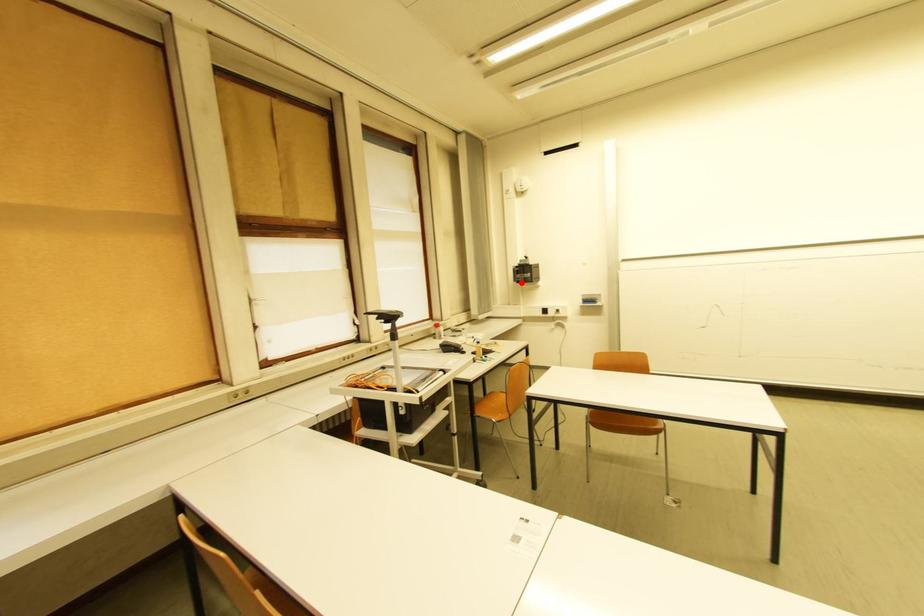
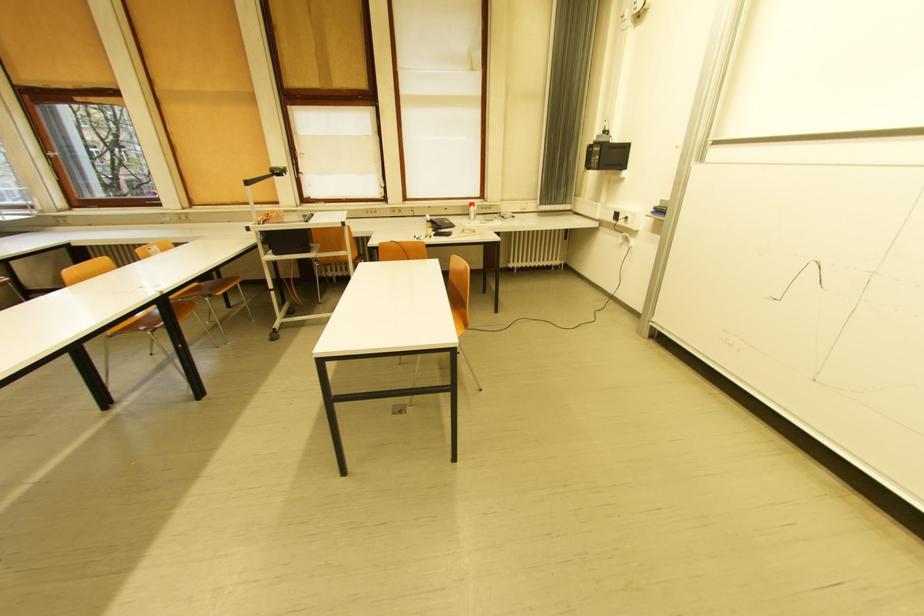
Question: I am providing you with two images of the same scene from different viewpoints. Given a red point in image1, look at the same physical point in image2. Is it:

Choices:
 (A) Closer to the viewpoint
 (B) Farther from the viewpoint

Answer: (A)